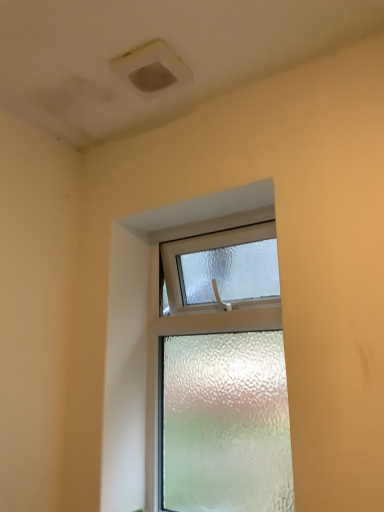
Locate an element on the screen. The image size is (384, 512). frosted glass window at center is located at coordinates click(x=221, y=377).

This screenshot has height=512, width=384. Describe the element at coordinates (221, 377) in the screenshot. I see `frosted glass window at center` at that location.

This screenshot has width=384, height=512. I want to click on frosted glass window at center, so click(221, 377).